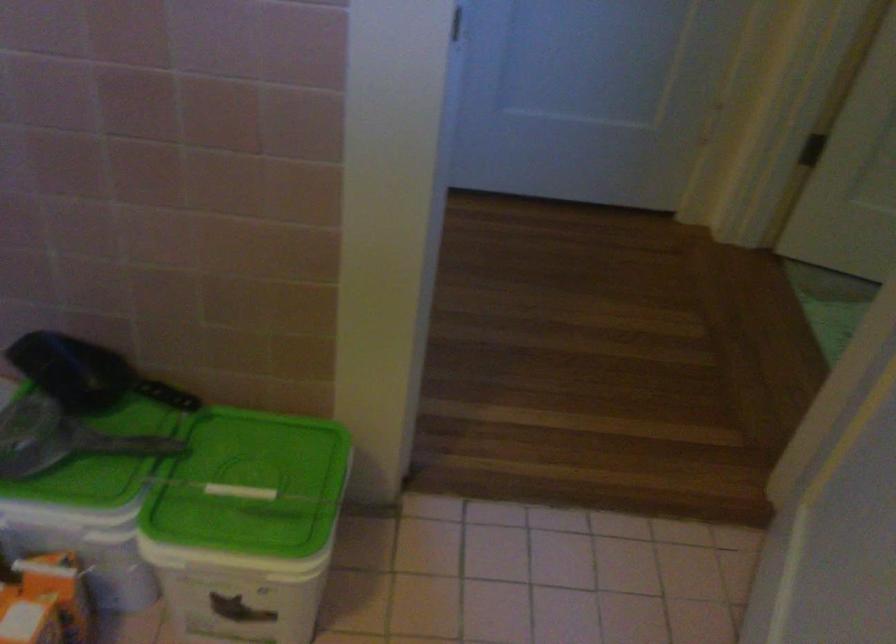
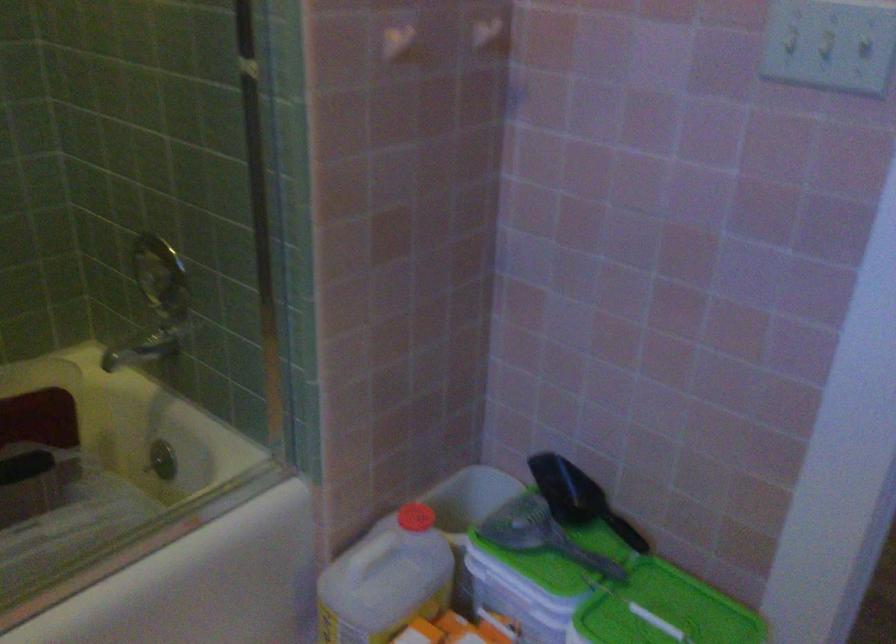
Where in the second image is the point corresponding to point 97,373 from the first image?

(578, 498)